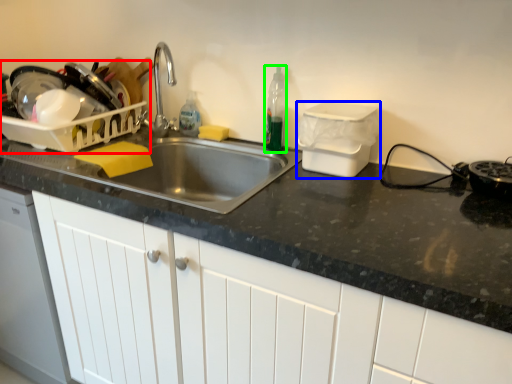
Question: Which is farther away from appliance (highlighted by a red box)? appliance (highlighted by a blue box) or bottle (highlighted by a green box)?

Choices:
 (A) appliance
 (B) bottle

Answer: (A)